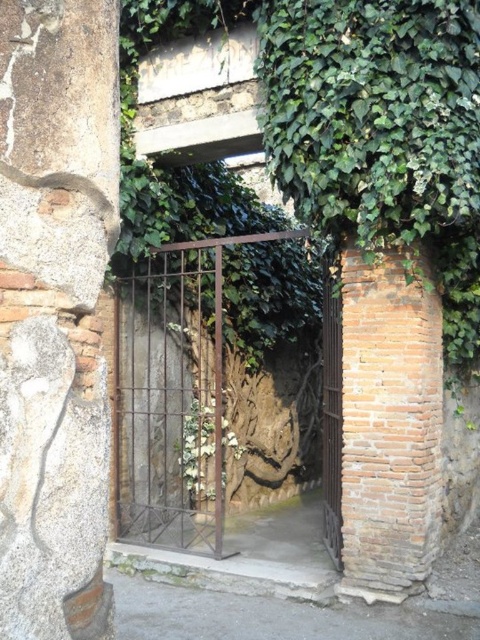
Which of these two, brown wrought iron gate at center or green leafy plant at center, stands taller?

brown wrought iron gate at center

Does brown wrought iron gate at center have a lesser height compared to green leafy plant at center?

Incorrect, brown wrought iron gate at center's height does not fall short of green leafy plant at center's.

Measure the distance between brown wrought iron gate at center and camera.

brown wrought iron gate at center is 6.18 meters away from camera.

The height and width of the screenshot is (640, 480). I want to click on brown wrought iron gate at center, so click(x=170, y=401).

Does rusty metal gate at center appear on the left side of green leafy plant at center?

No, rusty metal gate at center is not to the left of green leafy plant at center.

Does point (323, 394) lie in front of point (228, 449)?

No, it is not.

Does point (337, 406) come in front of point (207, 476)?

That is True.

This screenshot has width=480, height=640. What are the coordinates of `rusty metal gate at center` in the screenshot? It's located at (332, 413).

Can you confirm if brown wrought iron gate at center is positioned below rusty metal gate at center?

No, brown wrought iron gate at center is not below rusty metal gate at center.

Who is lower down, brown wrought iron gate at center or rusty metal gate at center?

Positioned lower is rusty metal gate at center.

Identify the location of brown wrought iron gate at center. The image size is (480, 640). (170, 401).